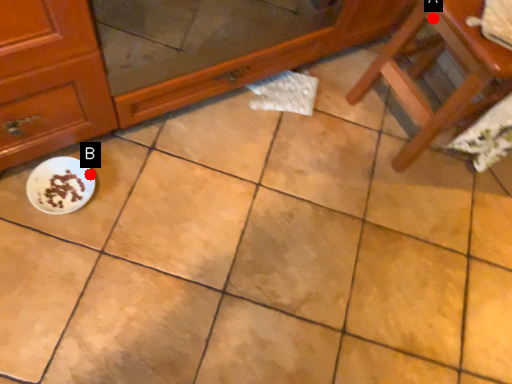
Question: Two points are circled on the image, labeled by A and B beside each circle. Which of the following is the farthest from the observer?

Choices:
 (A) A is further
 (B) B is further

Answer: (B)